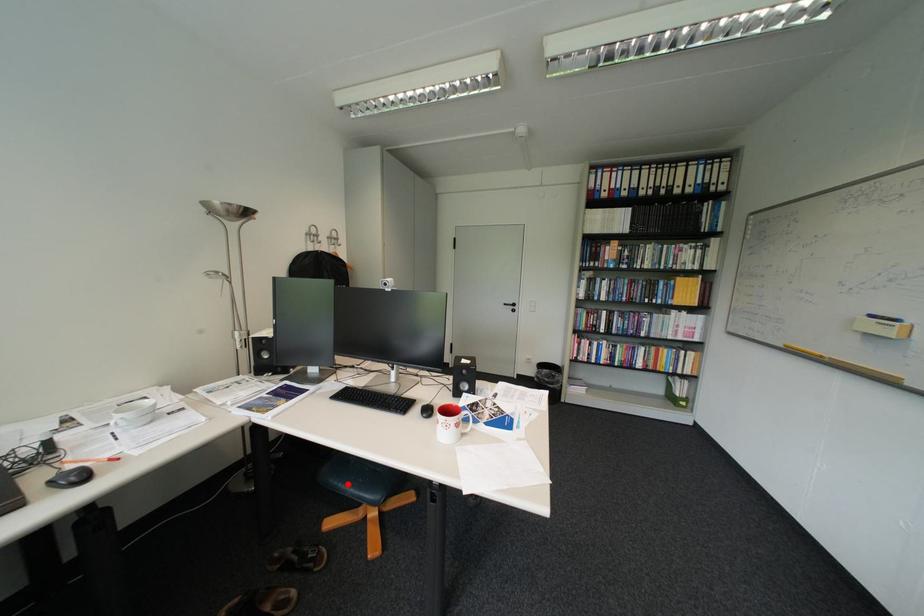
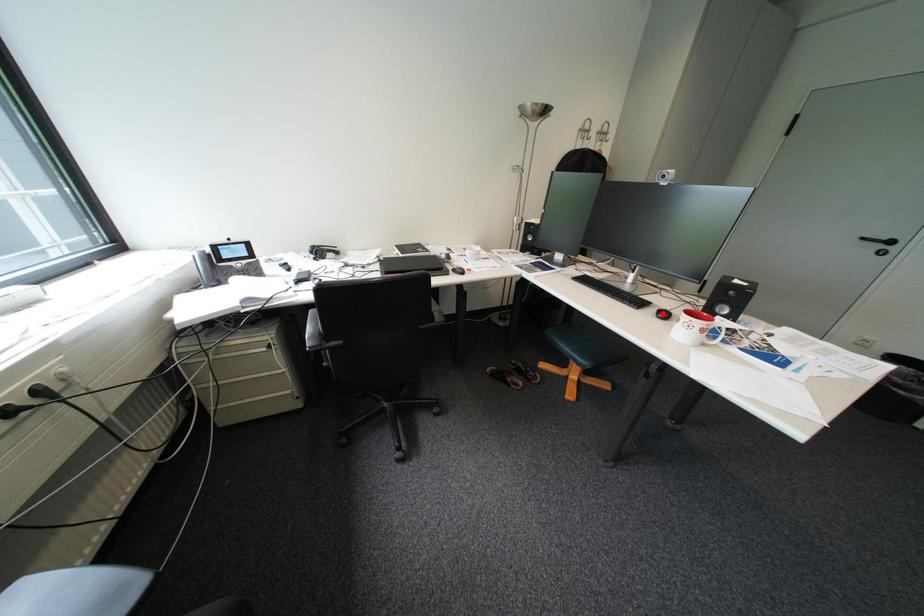
I am providing you with two images of the same scene from different viewpoints. A red point is marked on the first image and another point is marked on the second image. Is the marked point in image1 the same physical position as the marked point in image2?

No